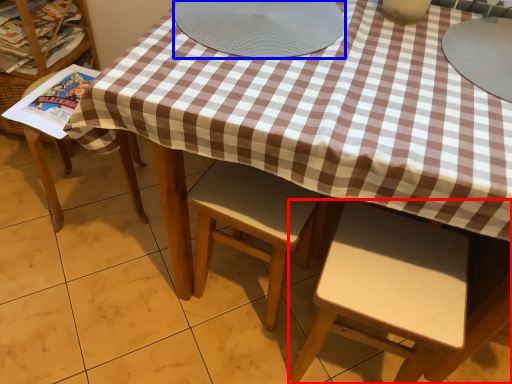
Question: Which point is closer to the camera, chair (highlighted by a red box) or platter (highlighted by a blue box)?

Choices:
 (A) chair
 (B) platter

Answer: (A)